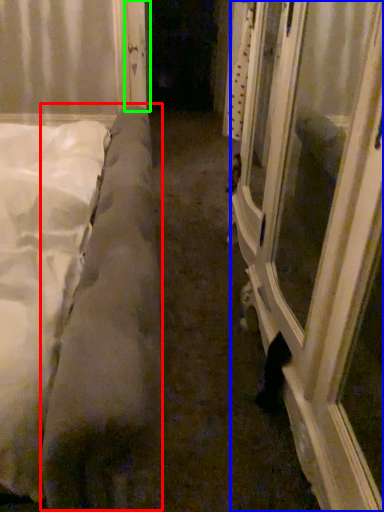
Question: Considering the real-world distances, which object is closest to mattress (highlighted by a red box)? window frame (highlighted by a blue box) or door (highlighted by a green box).

Choices:
 (A) window frame
 (B) door

Answer: (A)